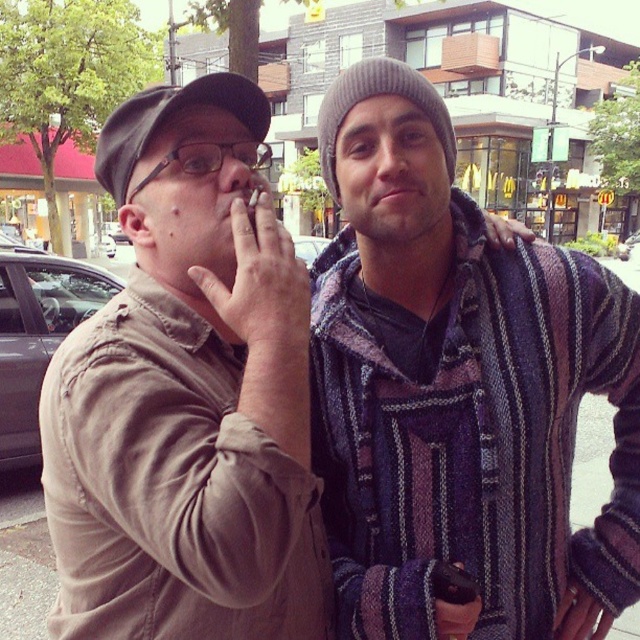
Question: Which point appears farthest from the camera in this image?

Choices:
 (A) [188, 88]
 (B) [403, 104]

Answer: (B)

Question: Is striped woolen sweater at center below matte khaki shirt at center?

Choices:
 (A) yes
 (B) no

Answer: (A)

Question: Among these points, which one is nearest to the camera?

Choices:
 (A) (244, 122)
 (B) (492, 305)

Answer: (A)

Question: Is striped woolen sweater at center further to the viewer compared to matte khaki shirt at center?

Choices:
 (A) no
 (B) yes

Answer: (B)

Question: Which of the following is the closest to the observer?

Choices:
 (A) striped woolen sweater at center
 (B) matte khaki shirt at center

Answer: (B)

Question: Does striped woolen sweater at center have a lesser width compared to matte khaki shirt at center?

Choices:
 (A) yes
 (B) no

Answer: (B)